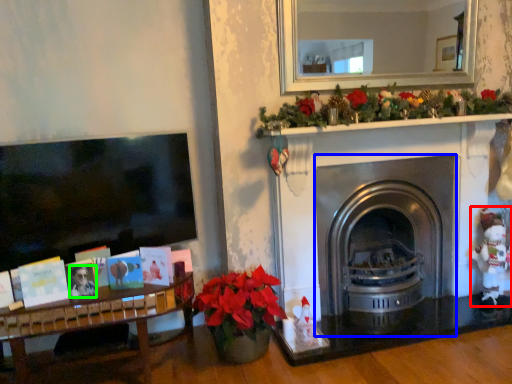
Question: Considering the real-world distances, which object is farthest from toy (highlighted by a red box)? fireplace (highlighted by a blue box) or person (highlighted by a green box)?

Choices:
 (A) fireplace
 (B) person

Answer: (B)